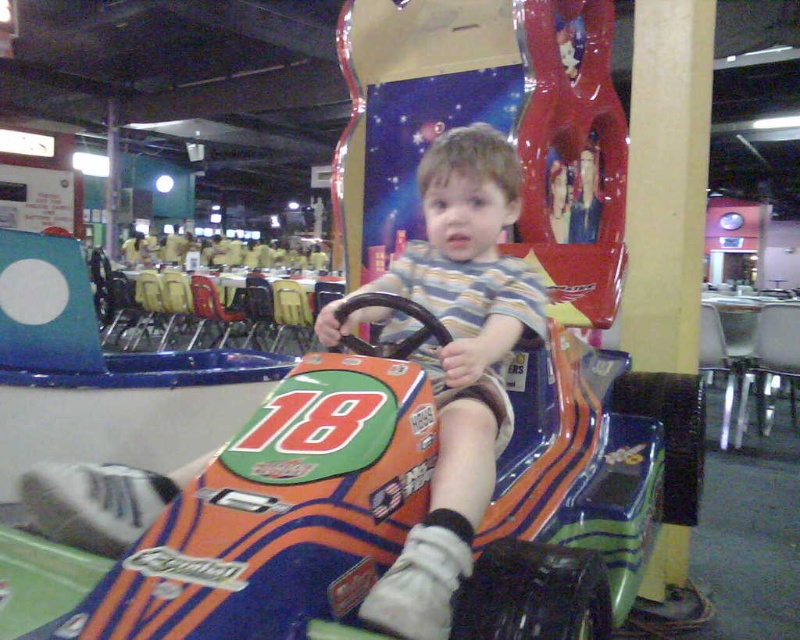
How much distance is there between orange glossy toy car at center and striped cotton shirt at center?

They are 8.99 inches apart.

Is orange glossy toy car at center wider than striped cotton shirt at center?

Yes.

This screenshot has height=640, width=800. Identify the location of orange glossy toy car at center. (266, 513).